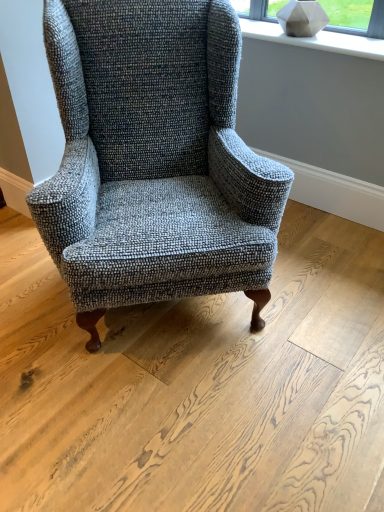
Question: Considering the positions of textured gray wingback chair at center and white matte stone at upper center in the image, is textured gray wingback chair at center taller or shorter than white matte stone at upper center?

Choices:
 (A) tall
 (B) short

Answer: (A)

Question: Would you say textured gray wingback chair at center is inside or outside white matte stone at upper center?

Choices:
 (A) inside
 (B) outside

Answer: (B)

Question: In the image, is textured gray wingback chair at center on the left side or the right side of white matte stone at upper center?

Choices:
 (A) left
 (B) right

Answer: (A)

Question: In the image, is white matte stone at upper center positioned in front of or behind textured gray wingback chair at center?

Choices:
 (A) front
 (B) behind

Answer: (B)

Question: From a real-world perspective, relative to textured gray wingback chair at center, is white matte stone at upper center vertically above or below?

Choices:
 (A) below
 (B) above

Answer: (B)

Question: From their relative heights in the image, would you say white matte stone at upper center is taller or shorter than textured gray wingback chair at center?

Choices:
 (A) short
 (B) tall

Answer: (A)

Question: Is point (261, 38) positioned closer to the camera than point (216, 135)?

Choices:
 (A) farther
 (B) closer

Answer: (A)